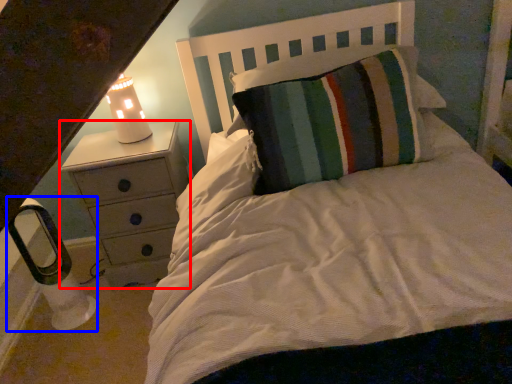
Question: Which of the following is the farthest to the observer, chest of drawers (highlighted by a red box) or lamp (highlighted by a blue box)?

Choices:
 (A) chest of drawers
 (B) lamp

Answer: (A)